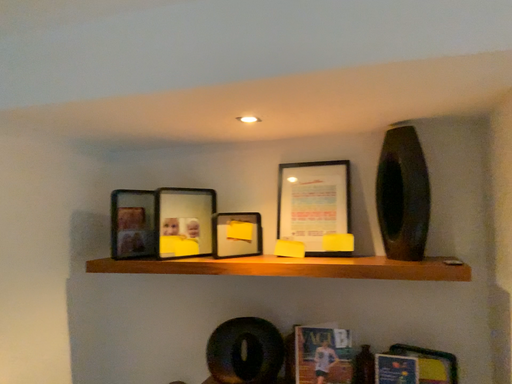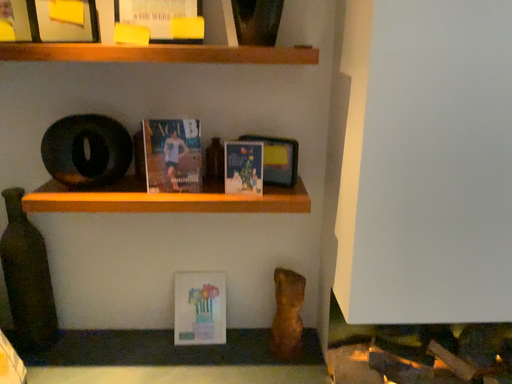
Question: Which way did the camera rotate in the video?

Choices:
 (A) rotated upward
 (B) rotated downward

Answer: (B)